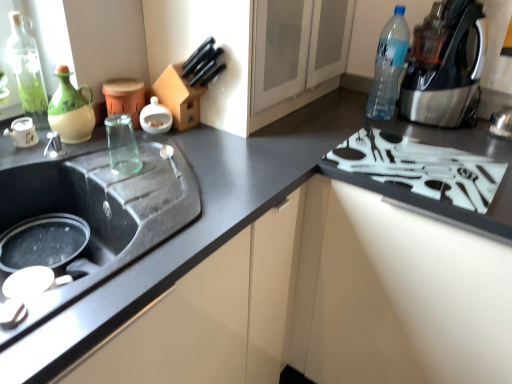
Identify the location of vacant space to the left of transparent glass cup at sink. (76, 158).